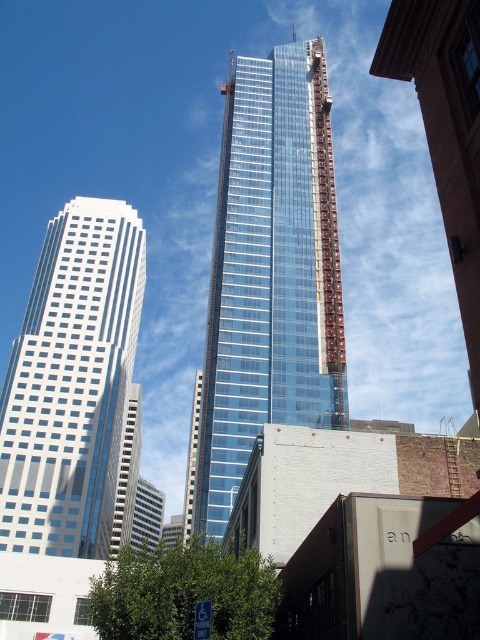
You are standing at the point marked as point (269, 273) in the urban landscape. What object are you facing directly?

The point (269, 273) marks the transparent glass tower at center, so you are facing the transparent glass tower at center directly.

You are an architect evaluating the urban layout. Given the transparent glass tower at center and the white glass building at left, which one would require more materials for constructing its exterior facade? Please base your answer on the information provided.

The transparent glass tower at center requires more materials for its exterior facade since it is larger in size than the white glass building at left.

You are an architect evaluating the urban skyline. Which of the two buildings, the transparent glass tower at center or the white glass building at left, has a greater height?

The transparent glass tower at center is taller than the white glass building at left.